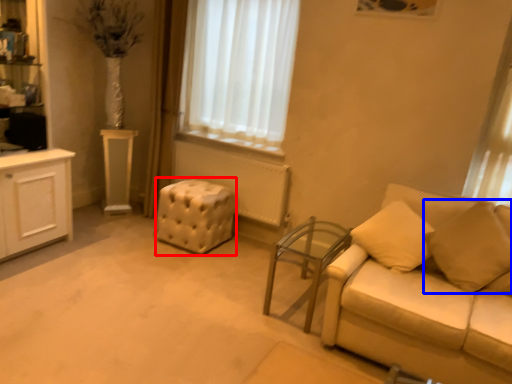
Question: Which point is further to the camera, stool (highlighted by a red box) or pillow (highlighted by a blue box)?

Choices:
 (A) stool
 (B) pillow

Answer: (A)